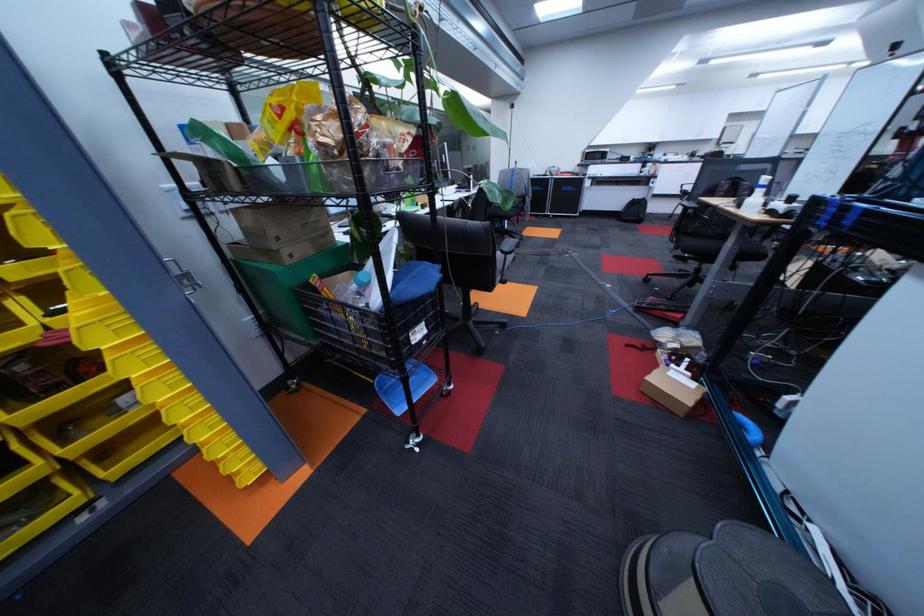
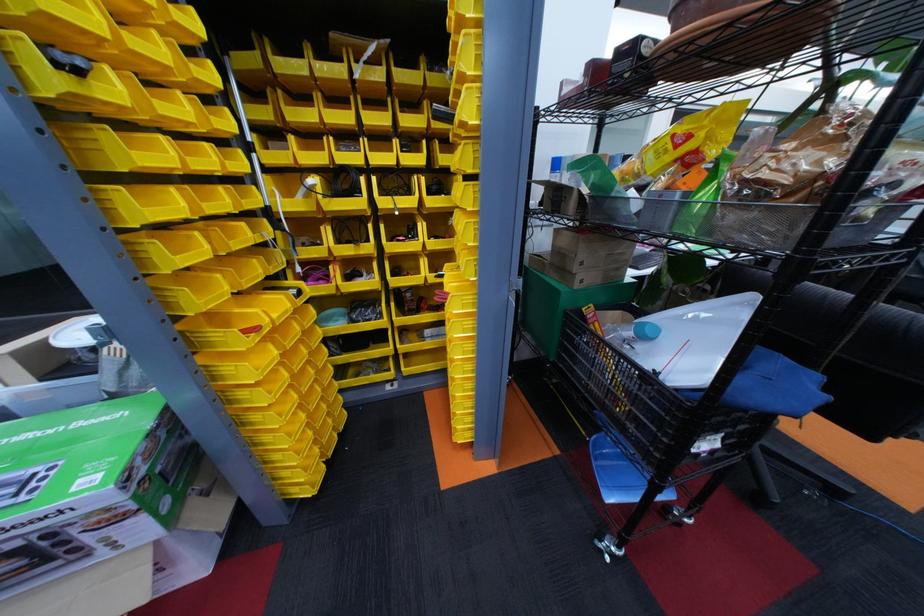
Find the pixel in the second image that matches the point at 368,288 in the first image.

(641, 334)